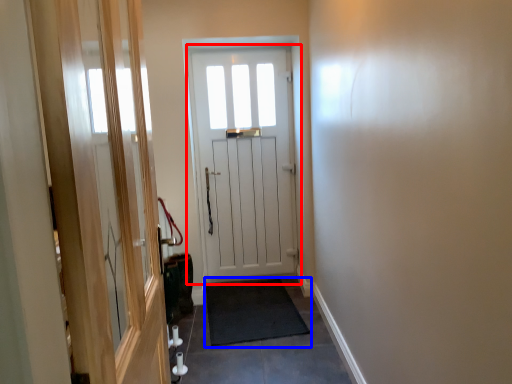
Question: Among these objects, which one is farthest to the camera, door (highlighted by a red box) or doormat (highlighted by a blue box)?

Choices:
 (A) door
 (B) doormat

Answer: (A)